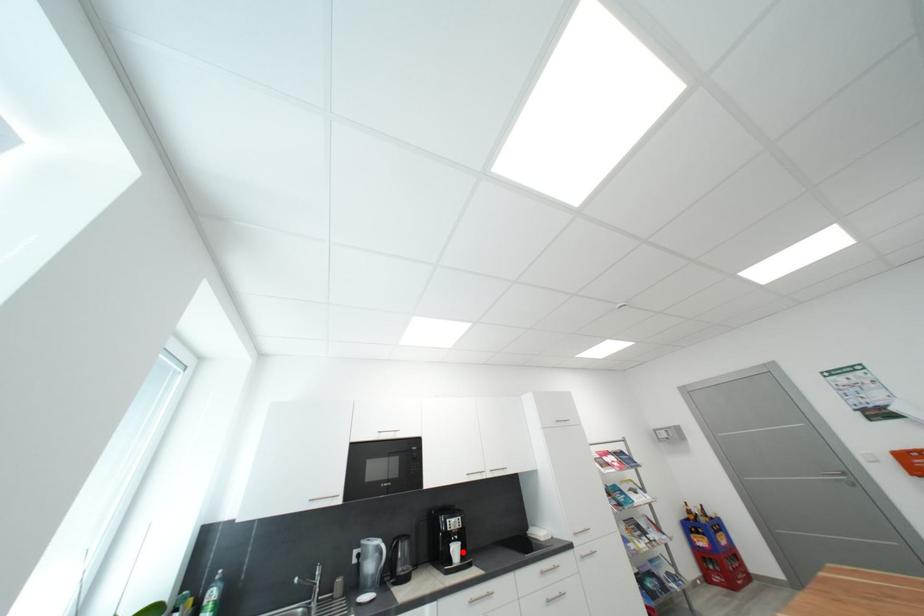
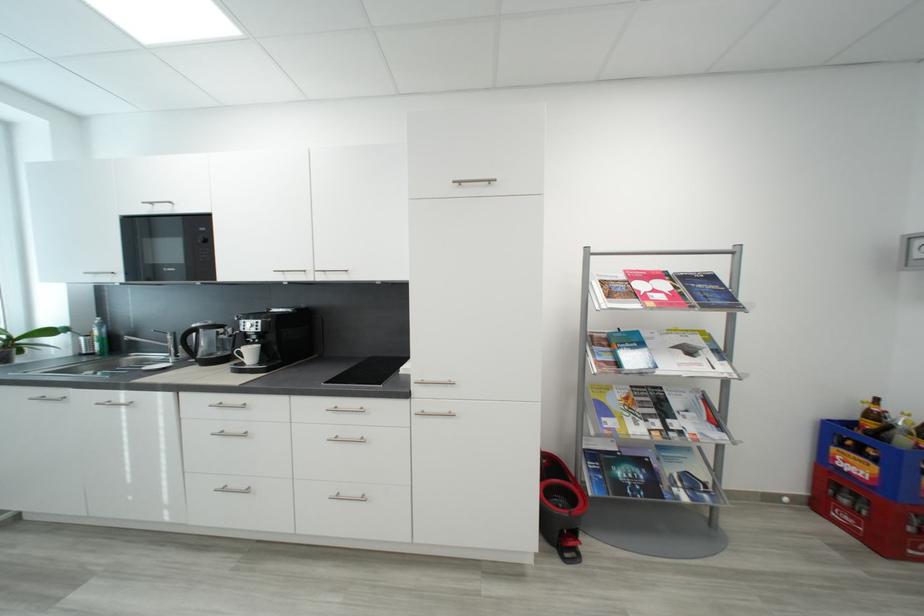
Question: I am providing you with two images of the same scene from different viewpoints. In image1, a red point is highlighted. Considering the same 3D point in image2, which of the following is correct?

Choices:
 (A) It is closer
 (B) It is farther

Answer: (A)